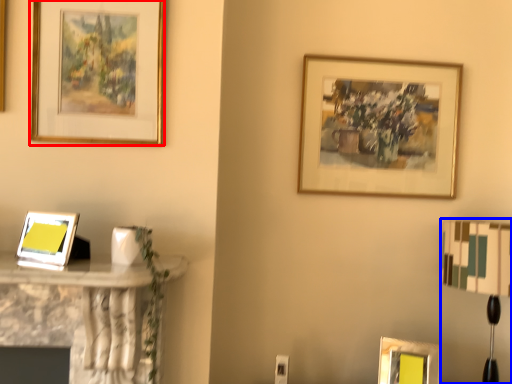
Question: Which object is closer to the camera taking this photo, picture frame (highlighted by a red box) or table lamp (highlighted by a blue box)?

Choices:
 (A) picture frame
 (B) table lamp

Answer: (A)